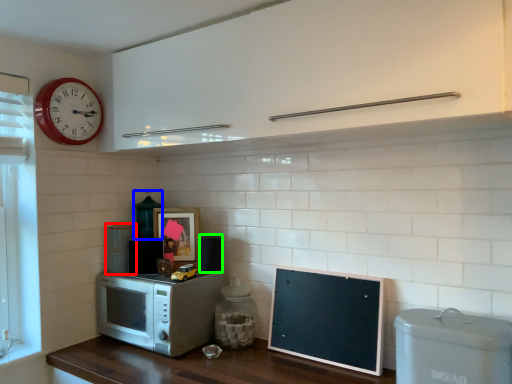
Question: Estimate the real-world distances between objects in this image. Which object is farther from appliance (highlighted by a red box), appliance (highlighted by a blue box) or appliance (highlighted by a green box)?

Choices:
 (A) appliance
 (B) appliance

Answer: (B)